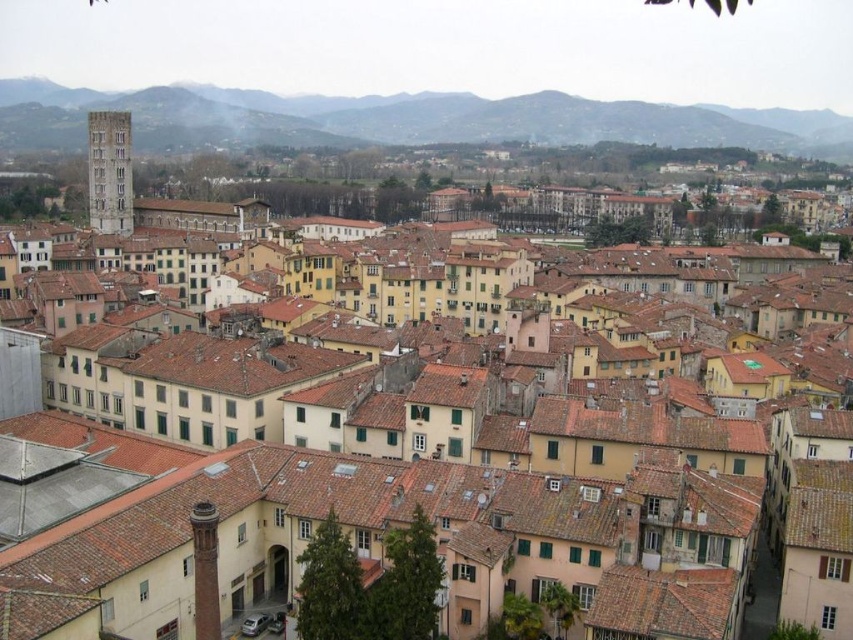
Who is lower down, brown grassy hillside at upper center or smooth stone tower at left?

smooth stone tower at left

Is point (67, 99) in front of point (103, 115)?

That is False.

The height and width of the screenshot is (640, 853). Identify the location of brown grassy hillside at upper center. (451, 116).